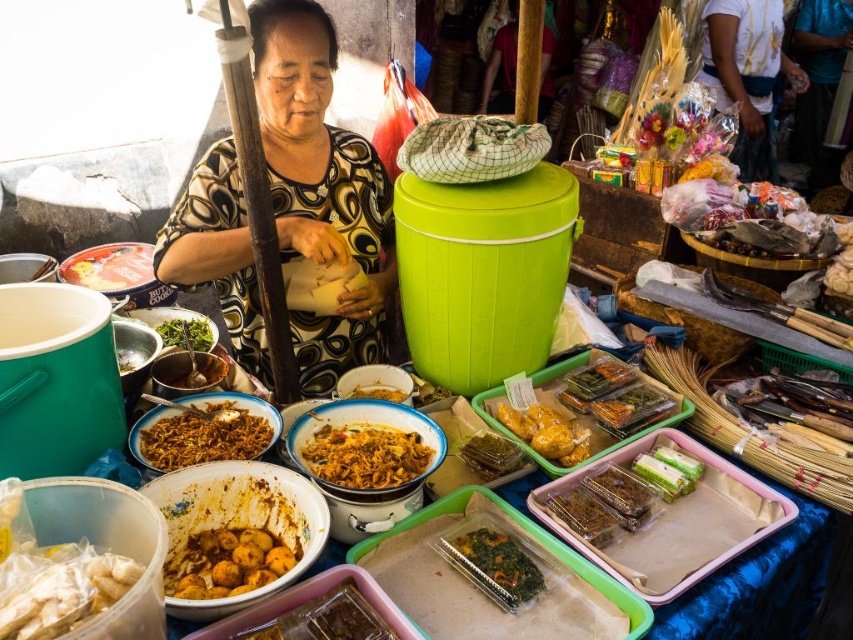
You are a customer at the food stall and want to grab both items located at point (125, 272) and point (527, 444). Which item should you pick up first to avoid blocking your view of the second one?

You should pick up the item at point (125, 272) first because it is closer to you, so if you pick it up first, it won t block your view of the item at point (527, 444) which is further away.

You are a customer at the street food stall and want to buy some food. Where is the white plastic bag at lower left located in the scene?

The white plastic bag at lower left is located at point (x=59, y=588) in the scene.